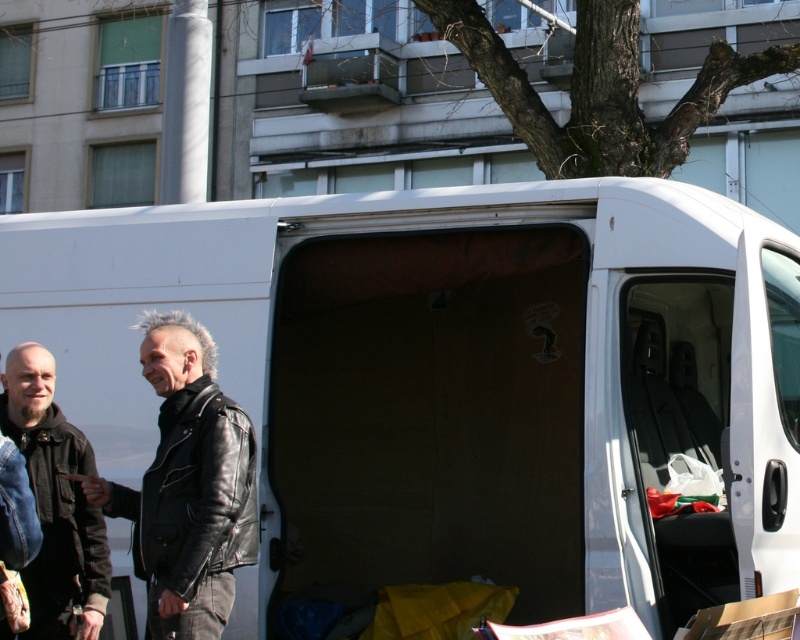
Consider the image. Who is taller, black leather jacket at center or leather jacket at left?

With more height is black leather jacket at center.

Describe the element at coordinates (188, 484) in the screenshot. I see `black leather jacket at center` at that location.

Is point (106, 484) farther from viewer compared to point (22, 545)?

Yes, point (106, 484) is farther from viewer.

Where is `black leather jacket at center`? This screenshot has width=800, height=640. black leather jacket at center is located at coordinates (188, 484).

Who is positioned more to the right, white matte van at center or matte black leather jacket at left?

Positioned to the right is white matte van at center.

Does white matte van at center have a greater width compared to matte black leather jacket at left?

Yes.

Find the location of a particular element. white matte van at center is located at coordinates (456, 381).

Does black leather jacket at center have a greater height compared to matte black leather jacket at left?

Yes, black leather jacket at center is taller than matte black leather jacket at left.

Is point (228, 604) more distant than point (88, 579)?

No, it is in front of (88, 579).

Is point (182, 536) more distant than point (41, 525)?

No, (182, 536) is in front of (41, 525).

This screenshot has height=640, width=800. What are the coordinates of `black leather jacket at center` in the screenshot? It's located at (188, 484).